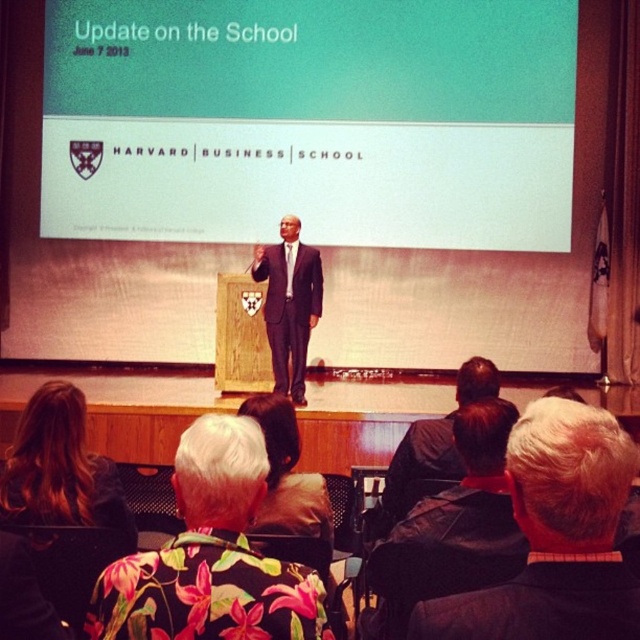
You are an event organizer who needs to ensure that the black suit at center and the black leather jacket at center can both fit on a 1.2 meter wide display rack. Based on their sizes, will they both fit comfortably?

The black suit at center is larger in size than the black leather jacket at center. However, without specific measurements, it is impossible to determine if both will fit on the 1.2 meter wide display rack. Additional information about their individual dimensions is required to make an accurate assessment.

You are a photographer standing at the front of the Harvard Business School presentation. You want to take a photo of the black leather jacket at lower right. Is the jacket within the 2.5 meter range of your camera lens? Please explain your reasoning.

The black leather jacket at lower right is 2.07 meters away from the camera. Since 2.07 meters is less than 2.5 meters, the jacket is within the camera lens range.

You are sitting in the audience and want to know which of the two points, point [444,547] or point [278,300], is closer to you. Which one is closer?

Point [444,547] is closer to the camera than point [278,300], so it is closer to you.